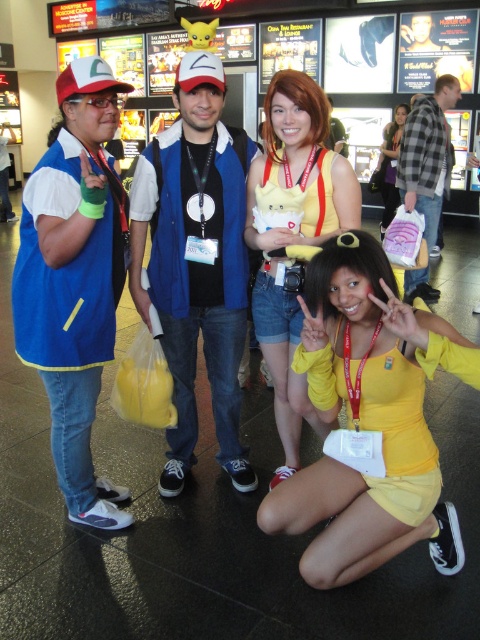
Question: Which is nearer to the matte blue vest at left?

Choices:
 (A) yellow fabric dress at lower center
 (B) yellow fabric dress at center
 (C) matte blue vest at center
 (D) plaid flannel shirt at upper right

Answer: (C)

Question: Is matte blue vest at left bigger than yellow fabric dress at lower center?

Choices:
 (A) no
 (B) yes

Answer: (A)

Question: Which point is farther from the camera taking this photo?

Choices:
 (A) (380, 227)
 (B) (112, 186)
 (C) (419, 208)

Answer: (A)

Question: Is the position of yellow matte dress at center less distant than that of yellow fabric dress at lower center?

Choices:
 (A) no
 (B) yes

Answer: (B)

Question: Which object appears farthest from the camera in this image?

Choices:
 (A) plaid flannel shirt at upper right
 (B) yellow fabric dress at lower center

Answer: (B)

Question: Does yellow fabric dress at center have a smaller size compared to yellow fabric dress at lower center?

Choices:
 (A) yes
 (B) no

Answer: (A)